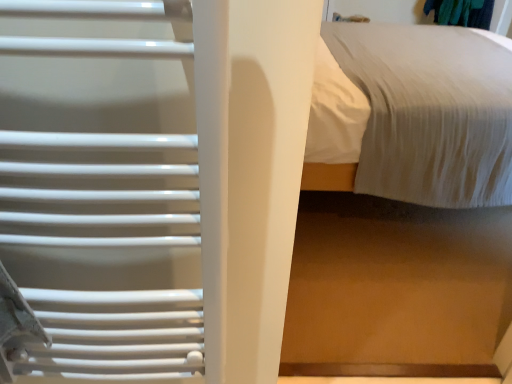
What is the approximate width of white textured bed at center, the 2th bed viewed from the back?

white textured bed at center, the 2th bed viewed from the back, is 10.45 centimeters wide.

The width and height of the screenshot is (512, 384). What are the coordinates of `white textured bed at upper right, positioned as the first bed in back-to-front order` in the screenshot? It's located at (421, 113).

How much space does white textured bed at upper right, positioned as the first bed in back-to-front order, occupy vertically?

The height of white textured bed at upper right, positioned as the first bed in back-to-front order, is 25.28 inches.

The width and height of the screenshot is (512, 384). Find the location of `white textured bed at center, the 2th bed viewed from the back`. white textured bed at center, the 2th bed viewed from the back is located at coordinates (396, 288).

Looking at this image, from the image's perspective, which is below, white matte radiator at left or white textured bed at center, the 2th bed viewed from the back?

From the image's view, white textured bed at center, the 2th bed viewed from the back, is below.

Between white matte radiator at left and white textured bed at center, marked as the 1th bed in a front-to-back arrangement, which one has larger size?

white textured bed at center, marked as the 1th bed in a front-to-back arrangement.

From a real-world perspective, is white matte radiator at left on white textured bed at center, marked as the 1th bed in a front-to-back arrangement?

Correct, in the physical world, white matte radiator at left is higher than white textured bed at center, marked as the 1th bed in a front-to-back arrangement.

Find the location of a particular element. cage on the left side of white textured bed at center, marked as the 1th bed in a front-to-back arrangement is located at coordinates (105, 251).

Between white matte radiator at left and white textured bed at upper right, positioned as the first bed in back-to-front order, which one has smaller width?

white matte radiator at left.

The height and width of the screenshot is (384, 512). I want to click on cage located below the white textured bed at upper right, positioned as the first bed in back-to-front order (from the image's perspective), so click(x=105, y=251).

Which is less distant, (355, 82) or (130, 179)?

Point (355, 82) appears to be farther away from the viewer than point (130, 179).

In the scene shown: Can you confirm if white textured bed at upper right, which is the second bed in front-to-back order, is bigger than white matte radiator at left?

Yes, white textured bed at upper right, which is the second bed in front-to-back order, is bigger than white matte radiator at left.

From a real-world perspective, between white textured bed at upper right, positioned as the first bed in back-to-front order, and white matte radiator at left, who is vertically higher?

white matte radiator at left.

Can you confirm if white textured bed at upper right, positioned as the first bed in back-to-front order, is taller than white textured bed at center, the 2th bed viewed from the back?

Incorrect, the height of white textured bed at upper right, positioned as the first bed in back-to-front order, is not larger of that of white textured bed at center, the 2th bed viewed from the back.

Which is behind, point (330, 87) or point (411, 64)?

Point (411, 64)

I want to click on bed lying in front of the white textured bed at upper right, positioned as the first bed in back-to-front order, so click(396, 288).

Consider the image. Would you consider white textured bed at center, the 2th bed viewed from the back, to be distant from white textured bed at upper right, which is the second bed in front-to-back order?

That's not correct — white textured bed at center, the 2th bed viewed from the back, is a little close to white textured bed at upper right, which is the second bed in front-to-back order.

Does point (472, 54) come closer to viewer compared to point (419, 55)?

No, (472, 54) is behind (419, 55).

Is white textured bed at upper right, which is the second bed in front-to-back order, at the back of white textured bed at center, marked as the 1th bed in a front-to-back arrangement?

Yes, white textured bed at center, marked as the 1th bed in a front-to-back arrangement, is facing away from white textured bed at upper right, which is the second bed in front-to-back order.

From the image's perspective, does white textured bed at center, marked as the 1th bed in a front-to-back arrangement, appear lower than white matte radiator at left?

Correct, white textured bed at center, marked as the 1th bed in a front-to-back arrangement, appears lower than white matte radiator at left in the image.

How different are the orientations of white textured bed at center, marked as the 1th bed in a front-to-back arrangement, and white matte radiator at left in degrees?

They differ by 0.922 degrees in their facing directions.

Is white textured bed at center, marked as the 1th bed in a front-to-back arrangement, inside or outside of white matte radiator at left?

white textured bed at center, marked as the 1th bed in a front-to-back arrangement, is located beyond the bounds of white matte radiator at left.

Between white textured bed at center, marked as the 1th bed in a front-to-back arrangement, and white matte radiator at left, which one has more height?

Standing taller between the two is white textured bed at center, marked as the 1th bed in a front-to-back arrangement.

Where is `cage in front of the white textured bed at center, the 2th bed viewed from the back`? cage in front of the white textured bed at center, the 2th bed viewed from the back is located at coordinates (105, 251).

Find the location of a particular element. bed located above the white matte radiator at left (from the image's perspective) is located at coordinates (421, 113).

From the image, which object appears to be farther from white textured bed at upper right, positioned as the first bed in back-to-front order, white textured bed at center, marked as the 1th bed in a front-to-back arrangement, or white matte radiator at left?

white matte radiator at left is positioned further to the anchor white textured bed at upper right, positioned as the first bed in back-to-front order.

Based on their spatial positions, is white matte radiator at left or white textured bed at upper right, positioned as the first bed in back-to-front order, closer to white textured bed at center, the 2th bed viewed from the back?

white textured bed at upper right, positioned as the first bed in back-to-front order.

Considering their positions, is white textured bed at upper right, positioned as the first bed in back-to-front order, positioned further to white matte radiator at left than white textured bed at center, marked as the 1th bed in a front-to-back arrangement?

Based on the image, white textured bed at upper right, positioned as the first bed in back-to-front order, appears to be further to white matte radiator at left.

Considering their positions, is white textured bed at center, marked as the 1th bed in a front-to-back arrangement, positioned further to white matte radiator at left than white textured bed at upper right, positioned as the first bed in back-to-front order?

The object further to white matte radiator at left is white textured bed at upper right, positioned as the first bed in back-to-front order.

Estimate the real-world distances between objects in this image. Which object is closer to white textured bed at center, marked as the 1th bed in a front-to-back arrangement, white textured bed at upper right, which is the second bed in front-to-back order, or white matte radiator at left?

Based on the image, white textured bed at upper right, which is the second bed in front-to-back order, appears to be nearer to white textured bed at center, marked as the 1th bed in a front-to-back arrangement.

Looking at the image, which one is located further to white textured bed at upper right, which is the second bed in front-to-back order, white matte radiator at left or white textured bed at center, marked as the 1th bed in a front-to-back arrangement?

Based on the image, white matte radiator at left appears to be further to white textured bed at upper right, which is the second bed in front-to-back order.

In order to click on bed situated between white matte radiator at left and white textured bed at upper right, positioned as the first bed in back-to-front order, from left to right in this screenshot , I will do `click(396, 288)`.